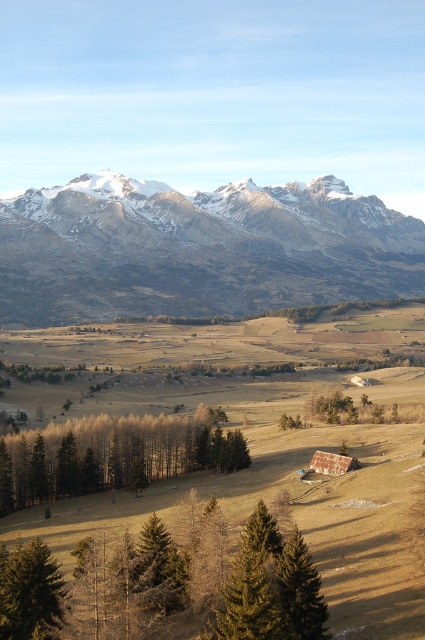
Can you confirm if snowy granite mountain range at upper center is wider than brown matte trees at center?

Indeed, snowy granite mountain range at upper center has a greater width compared to brown matte trees at center.

Can you confirm if snowy granite mountain range at upper center is shorter than brown matte trees at center?

No.

Find the location of a particular element. The image size is (425, 640). snowy granite mountain range at upper center is located at coordinates (198, 248).

The width and height of the screenshot is (425, 640). What are the coordinates of `snowy granite mountain range at upper center` in the screenshot? It's located at (198, 248).

Find the location of `green matte tree at lower center`. green matte tree at lower center is located at coordinates (167, 582).

Is green matte tree at lower center to the right of brown matte trees at center from the viewer's perspective?

Indeed, green matte tree at lower center is positioned on the right side of brown matte trees at center.

Which is behind, point (325, 616) or point (28, 493)?

The point (28, 493) is behind.

Identify the location of green matte tree at lower center. (167, 582).

Does snowy granite mountain range at upper center appear over green matte tree at lower left?

Indeed, snowy granite mountain range at upper center is positioned over green matte tree at lower left.

Based on the photo, can you confirm if snowy granite mountain range at upper center is taller than green matte tree at lower left?

Yes.

What do you see at coordinates (198, 248) in the screenshot? I see `snowy granite mountain range at upper center` at bounding box center [198, 248].

Where is `snowy granite mountain range at upper center`? The width and height of the screenshot is (425, 640). snowy granite mountain range at upper center is located at coordinates (198, 248).